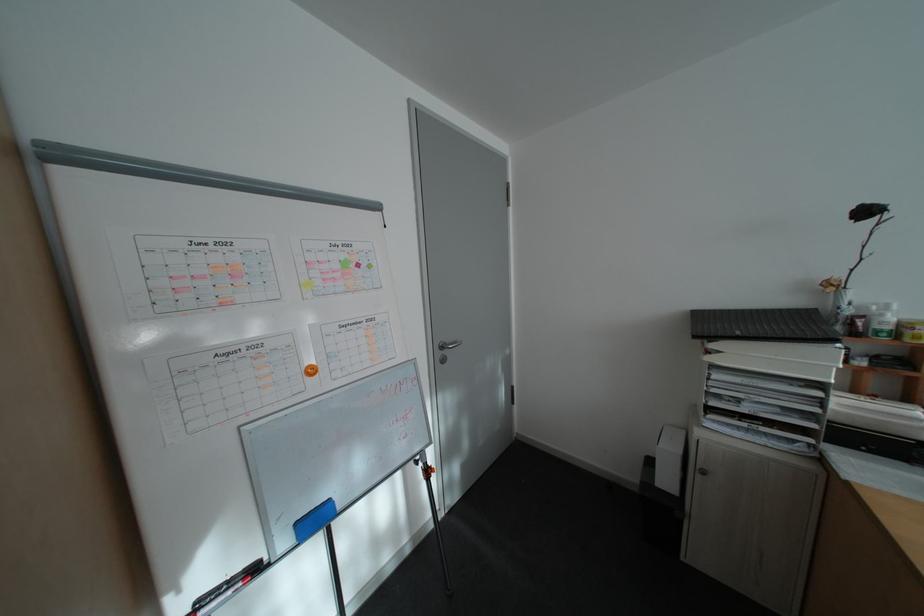
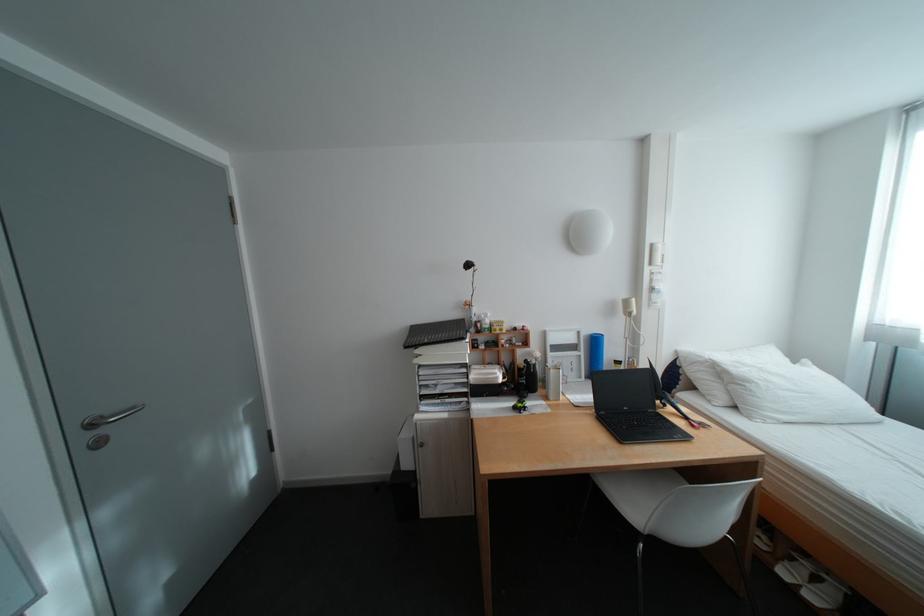
Find the pixel in the second image that matches point (452, 355) in the first image.

(99, 438)